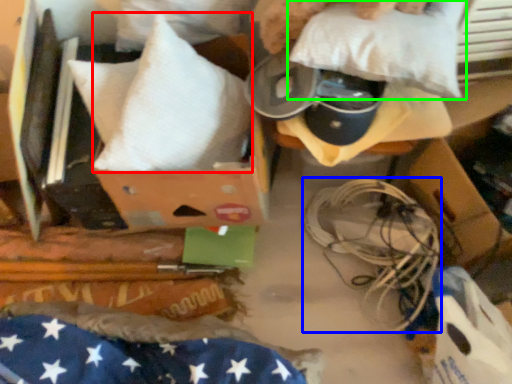
Question: Estimate the real-world distances between objects in this image. Which object is farther from pillow (highlighted by a red box), wire (highlighted by a blue box) or pillow (highlighted by a green box)?

Choices:
 (A) wire
 (B) pillow

Answer: (A)